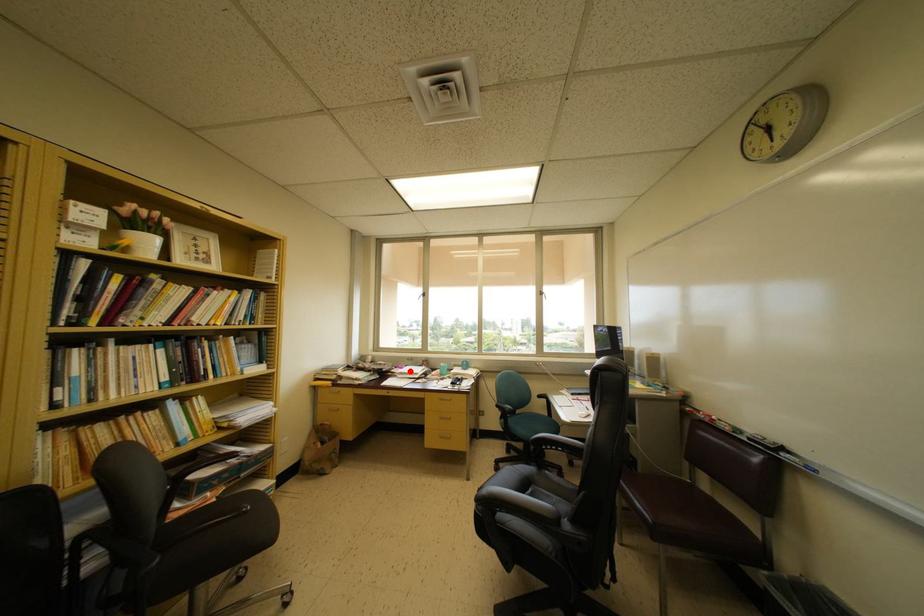
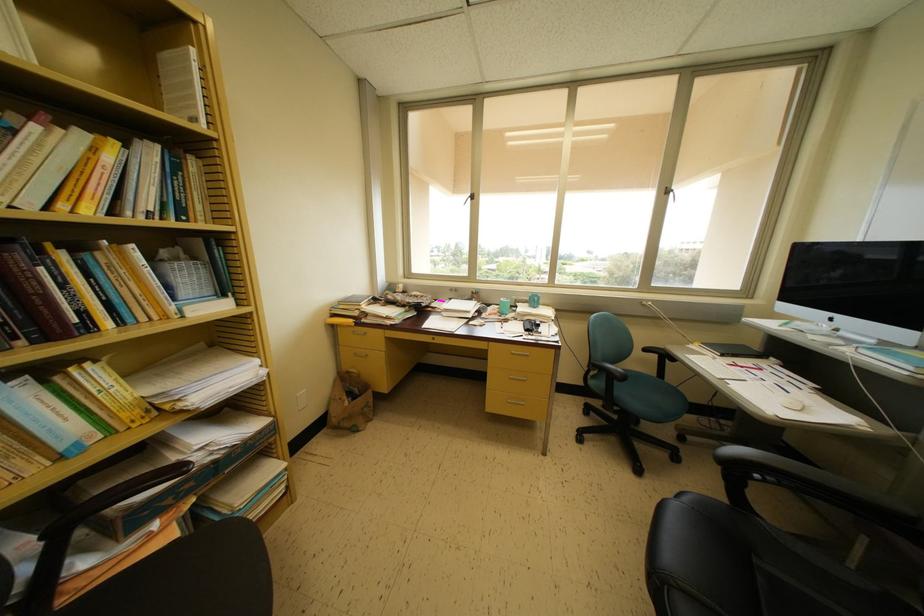
The point at the highlighted location is marked in the first image. Where is the corresponding point in the second image?

(455, 304)